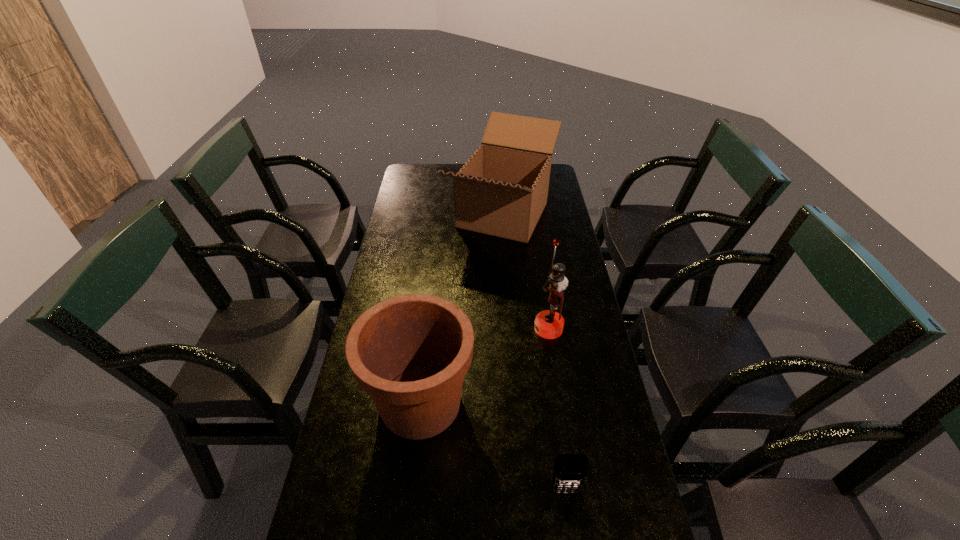
At what (x,y) coordinates should I click in order to perform the action: click on vacant space at the right edge. Please return your answer as a coordinate pair (x, y). The image size is (960, 540). Looking at the image, I should click on (566, 220).

Where is `free space between the box and the second farthest object`? free space between the box and the second farthest object is located at coordinates (526, 272).

You are a GUI agent. You are given a task and a screenshot of the screen. Output one action in this format:
    pyautogui.click(x=<x>, y=<y>)
    Task: Click on the blank region between the shortest object and the farthest object
    
    Given the screenshot: What is the action you would take?
    pyautogui.click(x=534, y=353)

I want to click on blank region between the nearest object and the second farthest object, so click(x=557, y=409).

Locate an element on the screen. vacant space in between the nearest object and the third nearest object is located at coordinates (557, 409).

Image resolution: width=960 pixels, height=540 pixels. In order to click on empty location between the third nearest object and the box in this screenshot , I will do `click(526, 272)`.

This screenshot has height=540, width=960. In order to click on free spot between the flowerpot and the shortest object in this screenshot , I will do `click(492, 447)`.

Image resolution: width=960 pixels, height=540 pixels. Identify the location of vacant region between the nearest object and the nutcracker. [557, 409].

Image resolution: width=960 pixels, height=540 pixels. What are the coordinates of `free spot between the box and the cellular telephone` in the screenshot? It's located at (534, 353).

Where is `vacant space in between the farthest object and the second shortest object`? This screenshot has height=540, width=960. vacant space in between the farthest object and the second shortest object is located at coordinates (462, 309).